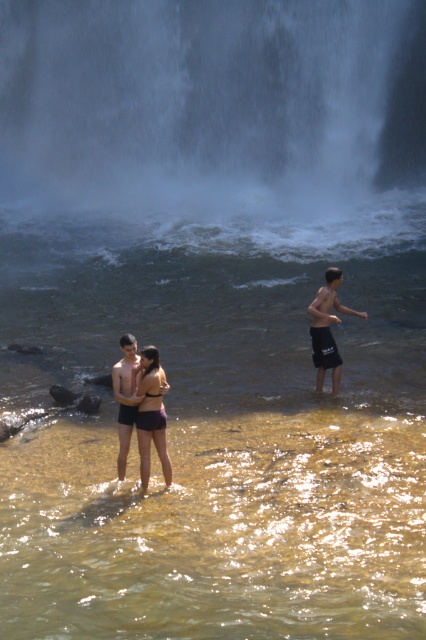
Question: Considering the relative positions of white misty waterfall at upper center and dark gray shorts at right in the image provided, where is white misty waterfall at upper center located with respect to dark gray shorts at right?

Choices:
 (A) below
 (B) above

Answer: (B)

Question: Among these points, which one is farthest from the camera?

Choices:
 (A) (317, 362)
 (B) (244, 74)

Answer: (B)

Question: Which object is farther from the camera taking this photo?

Choices:
 (A) dark gray shorts at right
 (B) purple matte shorts at center
 (C) white misty waterfall at upper center

Answer: (C)

Question: Which point is farther to the camera?

Choices:
 (A) (161, 102)
 (B) (328, 320)
 (C) (140, 410)
 (D) (135, 419)

Answer: (A)

Question: Does purple matte shorts at center appear over dark gray shorts at right?

Choices:
 (A) yes
 (B) no

Answer: (B)

Question: Is white misty waterfall at upper center thinner than dark gray shorts at right?

Choices:
 (A) no
 (B) yes

Answer: (A)